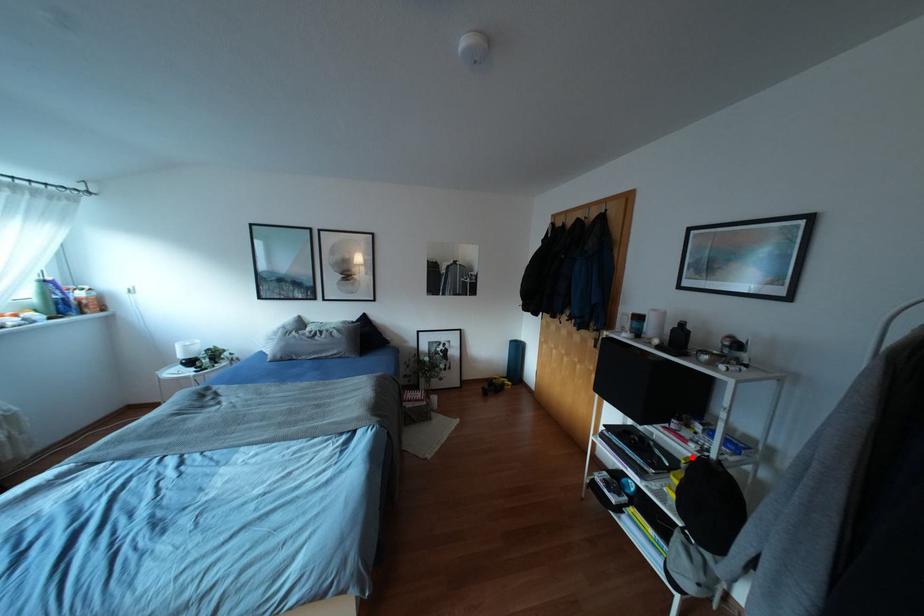
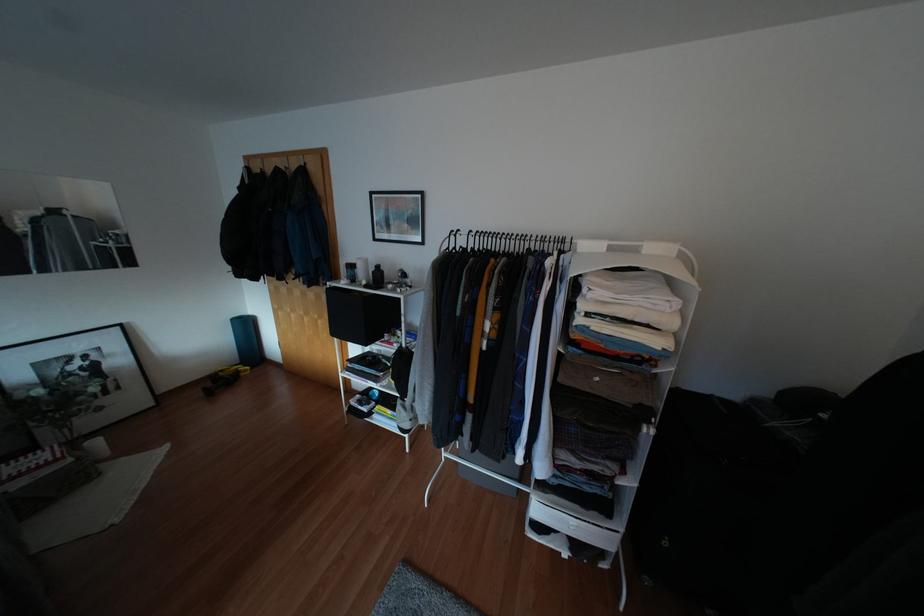
Find the pixel in the second image that matches the highlighted location in the first image.

(394, 351)